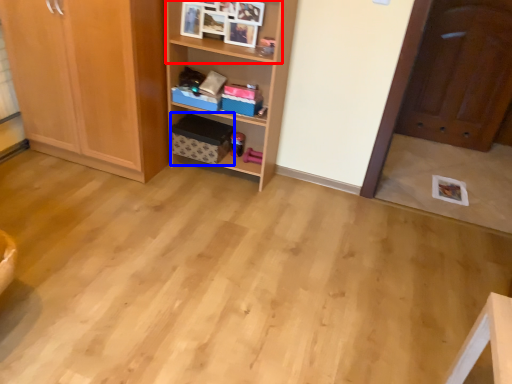
Question: Which point is further to the camera, cabinet (highlighted by a red box) or cardboard box (highlighted by a blue box)?

Choices:
 (A) cabinet
 (B) cardboard box

Answer: (B)